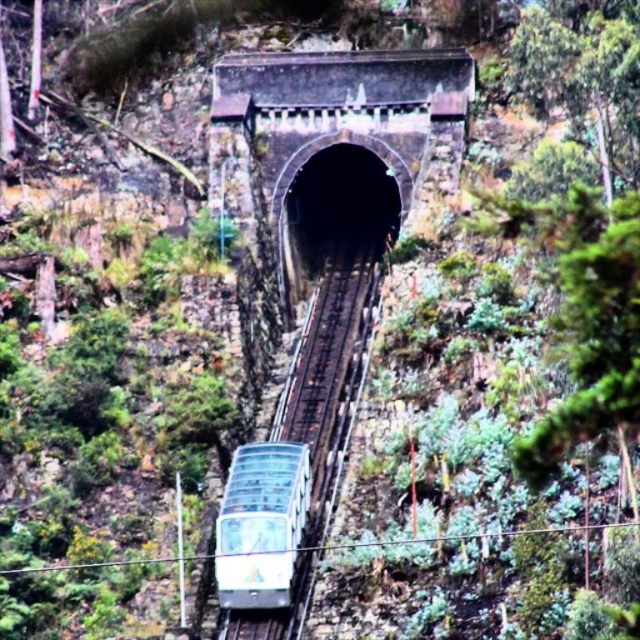
Question: Among these points, which one is nearest to the camera?

Choices:
 (A) (280, 536)
 (B) (289, 416)

Answer: (A)

Question: Does metallic track at center appear over clear glass train at center?

Choices:
 (A) no
 (B) yes

Answer: (B)

Question: Does metallic track at center have a lesser width compared to clear glass train at center?

Choices:
 (A) no
 (B) yes

Answer: (A)

Question: Considering the relative positions of metallic track at center and clear glass train at center in the image provided, where is metallic track at center located with respect to clear glass train at center?

Choices:
 (A) above
 (B) below

Answer: (A)